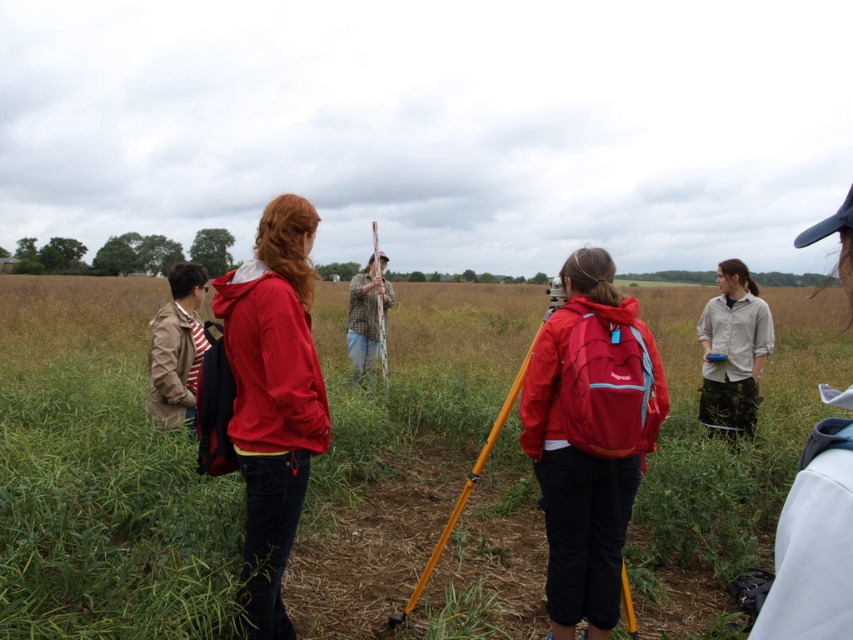
Question: Estimate the real-world distances between objects in this image. Which object is farther from the matte red jacket at center?

Choices:
 (A) matte red backpack at center
 (B) camouflage pants at center
 (C) plaid fabric shirt at center

Answer: (C)

Question: Is the position of green grass at center less distant than that of plaid fabric shirt at center?

Choices:
 (A) no
 (B) yes

Answer: (B)

Question: Does green grass at center appear on the left side of light gray shirt at right?

Choices:
 (A) no
 (B) yes

Answer: (B)

Question: Estimate the real-world distances between objects in this image. Which object is closer to the matte red backpack at center?

Choices:
 (A) light gray shirt at right
 (B) striped cotton shirt at left
 (C) camouflage pants at center

Answer: (A)

Question: Observing the image, what is the correct spatial positioning of green grass at center in reference to matte red jacket at center?

Choices:
 (A) right
 (B) left

Answer: (B)

Question: Based on their relative distances, which object is nearer to the matte red backpack at center?

Choices:
 (A) striped cotton shirt at left
 (B) matte red jacket at center
 (C) green grass at center
 (D) light gray shirt at right

Answer: (B)